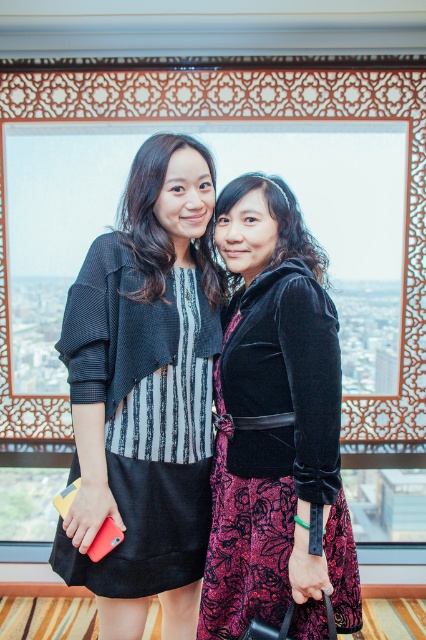
Does velvet/black dress at center have a smaller size compared to black velvet dress at center?

No.

Is velvet/black dress at center positioned behind black velvet dress at center?

That is False.

The width and height of the screenshot is (426, 640). I want to click on velvet/black dress at center, so click(x=276, y=452).